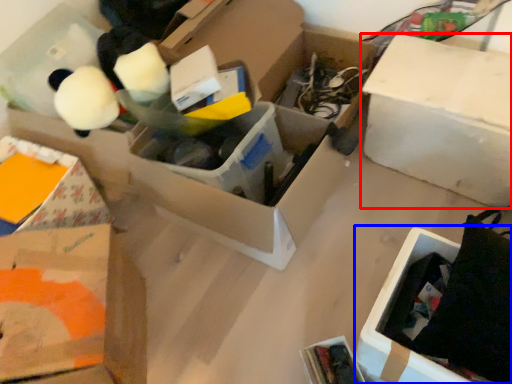
Question: Which object appears farthest to the camera in this image, box (highlighted by a red box) or cardboard box (highlighted by a blue box)?

Choices:
 (A) box
 (B) cardboard box

Answer: (A)